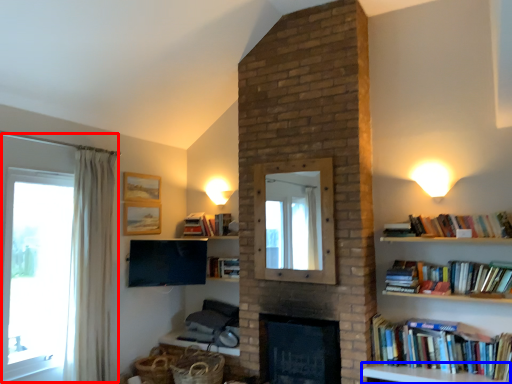
Question: Among these objects, which one is farthest to the camera, window (highlighted by a red box) or furniture (highlighted by a blue box)?

Choices:
 (A) window
 (B) furniture

Answer: (A)